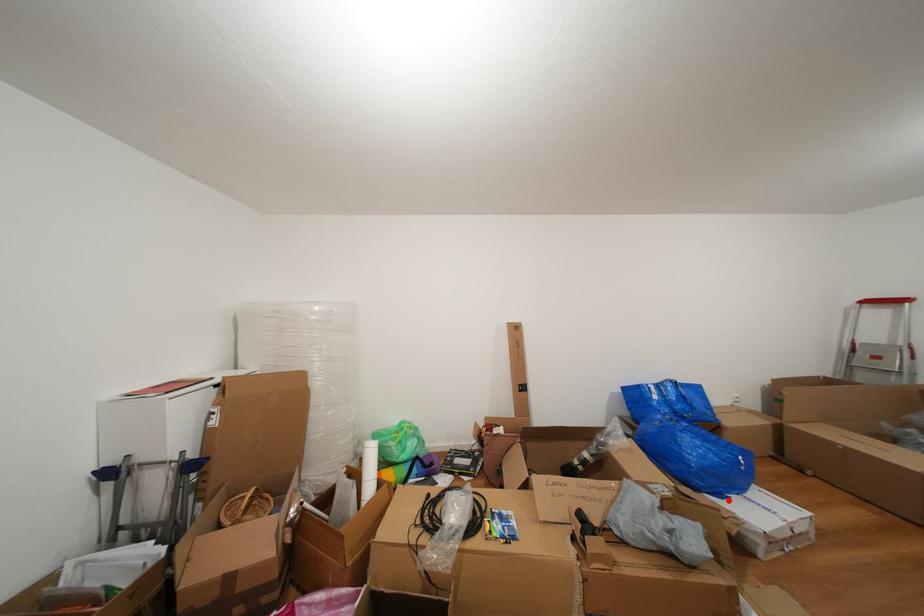
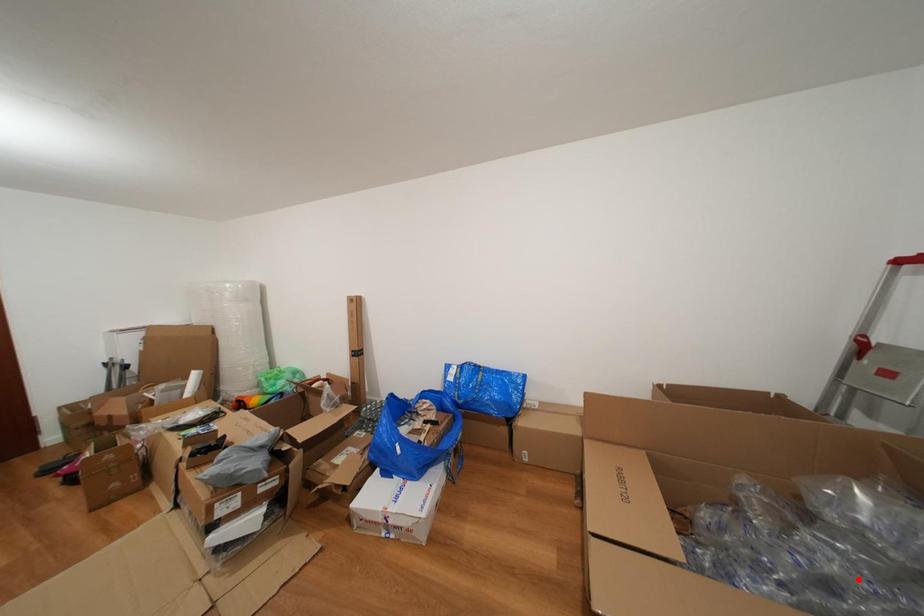
I am providing you with two images of the same scene from different viewpoints. A red point is marked on the first image and another point is marked on the second image. Are the points marked in image1 and image2 representing the same 3D position?

No